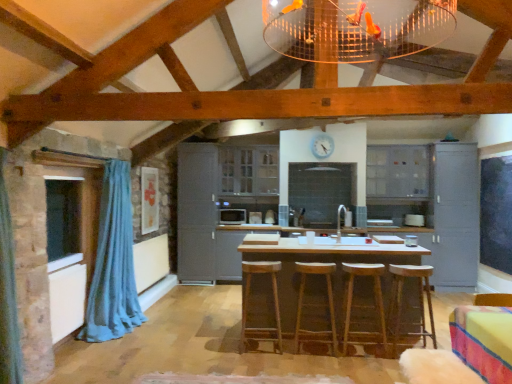
Find the location of a particular element. The width and height of the screenshot is (512, 384). wooden table at center is located at coordinates (323, 290).

In order to face transparent glass window at left, should I rotate leftwards or rightwards?

Rotate left and turn 24.124 degrees.

What do you see at coordinates (63, 222) in the screenshot? I see `transparent glass window at left` at bounding box center [63, 222].

What is the approximate width of wooden bar stool at center, positioned as the second bar stool in left-to-right order?

wooden bar stool at center, positioned as the second bar stool in left-to-right order, is 14.33 inches in width.

You are a GUI agent. You are given a task and a screenshot of the screen. Output one action in this format:
    pyautogui.click(x=<x>, y=<y>)
    Task: Click on the satin black microwave at center
    
    Given the screenshot: What is the action you would take?
    pyautogui.click(x=232, y=216)

Locate an element on the screen. This screenshot has width=512, height=384. wooden table at center is located at coordinates (323, 290).

Considering the positions of objects wooden table at center and wooden bar stool at center, placed as the fourth bar stool when sorted from left to right, in the image provided, who is behind, wooden table at center or wooden bar stool at center, placed as the fourth bar stool when sorted from left to right,?

wooden table at center.

Is point (306, 326) positioned before point (428, 332)?

No, (306, 326) is behind (428, 332).

Consider the image. Between wooden table at center and wooden bar stool at center, placed as the fourth bar stool when sorted from left to right, which one has larger size?

wooden table at center.

From the image's perspective, does matte gray cabinet at center, the 1th cabinetry when ordered from left to right, appear lower than wooden bar stool at center?

Actually, matte gray cabinet at center, the 1th cabinetry when ordered from left to right, appears above wooden bar stool at center in the image.

Which object is more forward, matte gray cabinet at center, the fourth cabinetry when ordered from right to left, or wooden bar stool at center?

wooden bar stool at center is closer to the camera.

Is point (180, 233) positioned behind point (372, 237)?

That is True.

Identify the location of chair below the matte gray cabinet at center, the fourth cabinetry when ordered from right to left (from a real-world perspective). The width and height of the screenshot is (512, 384). point(388,239).

Between point (391, 271) and point (406, 149), which one is positioned behind?

Point (406, 149)

In the scene shown: In the image, is wooden bar stool at center, placed as the fourth bar stool when sorted from left to right, on the left side or the right side of matte gray cabinets at upper right, the 3th cabinetry viewed from the left?

From the image, it's evident that wooden bar stool at center, placed as the fourth bar stool when sorted from left to right, is to the left of matte gray cabinets at upper right, the 3th cabinetry viewed from the left.

Is transparent glass window at left facing away from satin black microwave at center?

No, transparent glass window at left is not facing away from satin black microwave at center.

Find the location of a particular element. This screenshot has width=512, height=384. appliance behind the transparent glass window at left is located at coordinates (232, 216).

Which of these two, transparent glass window at left or satin black microwave at center, stands shorter?

satin black microwave at center.

Is point (111, 296) closer or farther from the camera than point (399, 326)?

Point (111, 296) is positioned farther from the camera compared to point (399, 326).

Is blue fabric curtain at left far away from wooden bar stool at center, placed as the fourth bar stool when sorted from left to right?

Yes, blue fabric curtain at left and wooden bar stool at center, placed as the fourth bar stool when sorted from left to right, are quite far apart.

Who is bigger, blue fabric curtain at left or wooden bar stool at center, marked as the 1th bar stool in a right-to-left arrangement?

Bigger between the two is blue fabric curtain at left.

Which is in front, blue fabric curtain at left or wooden bar stool at center, placed as the fourth bar stool when sorted from left to right?

Positioned in front is wooden bar stool at center, placed as the fourth bar stool when sorted from left to right.

Is brown wooden bar stool at center, placed as the 1th bar stool when sorted from left to right, aimed at wooden bar stool at center, arranged as the 3th bar stool when viewed from the right?

No, brown wooden bar stool at center, placed as the 1th bar stool when sorted from left to right, is not facing towards wooden bar stool at center, arranged as the 3th bar stool when viewed from the right.

From a real-world perspective, who is located higher, brown wooden bar stool at center, arranged as the 4th bar stool when viewed from the right, or wooden bar stool at center, positioned as the second bar stool in left-to-right order?

brown wooden bar stool at center, arranged as the 4th bar stool when viewed from the right, is physically above.

In terms of width, does brown wooden bar stool at center, placed as the 1th bar stool when sorted from left to right, look wider or thinner when compared to wooden bar stool at center, arranged as the 3th bar stool when viewed from the right?

Clearly, brown wooden bar stool at center, placed as the 1th bar stool when sorted from left to right, has less width compared to wooden bar stool at center, arranged as the 3th bar stool when viewed from the right.

From the image's perspective, does brown wooden bar stool at center, placed as the 1th bar stool when sorted from left to right, appear lower than wooden bar stool at center, positioned as the second bar stool in left-to-right order?

No, from the image's perspective, brown wooden bar stool at center, placed as the 1th bar stool when sorted from left to right, is not below wooden bar stool at center, positioned as the second bar stool in left-to-right order.

Is satin black microwave at center touching wooden table at center?

No, satin black microwave at center is not next to wooden table at center.

From a real-world perspective, is satin black microwave at center physically above wooden table at center?

Correct, in the physical world, satin black microwave at center is higher than wooden table at center.

From the image's perspective, is satin black microwave at center above wooden table at center?

Yes, from the image's perspective, satin black microwave at center is on top of wooden table at center.

Is wooden table at center at the back of satin black microwave at center?

No, satin black microwave at center's orientation is not away from wooden table at center.

The image size is (512, 384). In order to click on table located behind the wooden bar stool at center, placed as the fourth bar stool when sorted from left to right in this screenshot , I will do `click(323, 290)`.

From the image's perspective, count 2nd cabinetrys upward from the wooden bar stool at center and point to it. Please provide its 2D coordinates.

[(196, 211)]

Looking at this image, considering their positions, is matte gray cabinet at center, the 1th cabinetry when ordered from left to right, positioned closer to wooden bar stool at center, placed as the fourth bar stool when sorted from left to right, than matte gray cabinets at center, arranged as the 2th cabinetry when viewed from the left?

matte gray cabinets at center, arranged as the 2th cabinetry when viewed from the left.

Which object lies nearer to the anchor point wooden bar stool at center, marked as the 1th bar stool in a right-to-left arrangement, wooden bar stool at center, arranged as the 3th bar stool when viewed from the right, or blue fabric curtain at left?

wooden bar stool at center, arranged as the 3th bar stool when viewed from the right, lies closer to wooden bar stool at center, marked as the 1th bar stool in a right-to-left arrangement, than the other object.

Estimate the real-world distances between objects in this image. Which object is closer to blue fabric curtain at left, wooden bar stool at center, marked as the 1th bar stool in a right-to-left arrangement, or matte gray cabinets at upper right, which is the 2th cabinetry in right-to-left order?

Based on the image, wooden bar stool at center, marked as the 1th bar stool in a right-to-left arrangement, appears to be nearer to blue fabric curtain at left.

Considering their positions, is wooden bar stool at center, placed as the fourth bar stool when sorted from left to right, positioned closer to matte gray cabinets at upper right, the 3th cabinetry viewed from the left, than transparent glass window at left?

The object closer to matte gray cabinets at upper right, the 3th cabinetry viewed from the left, is wooden bar stool at center, placed as the fourth bar stool when sorted from left to right.

Based on the photo, when comparing their distances from wooden table at center, does brown wooden bar stool at center, placed as the 1th bar stool when sorted from left to right, or wooden bar stool at center, which is the 3th bar stool from left to right, seem closer?

wooden bar stool at center, which is the 3th bar stool from left to right.

Which object lies further to the anchor point satin black microwave at center, brown wooden bar stool at center, arranged as the 4th bar stool when viewed from the right, or matte gray cabinet at right, positioned as the 1th cabinetry in right-to-left order?

Among the two, matte gray cabinet at right, positioned as the 1th cabinetry in right-to-left order, is located further to satin black microwave at center.

Which object lies further to the anchor point matte gray cabinets at upper right, which is the 2th cabinetry in right-to-left order, transparent glass window at left or matte gray cabinets at center, arranged as the 3th cabinetry when viewed from the right?

transparent glass window at left.

Considering their positions, is matte gray cabinets at center, arranged as the 3th cabinetry when viewed from the right, positioned closer to wooden bar stool at center, arranged as the 3th bar stool when viewed from the right, than transparent glass window at left?

transparent glass window at left is positioned closer to the anchor wooden bar stool at center, arranged as the 3th bar stool when viewed from the right.

Where is `table between wooden bar stool at center, marked as the 1th bar stool in a right-to-left arrangement, and matte gray cabinet at right, which appears as the fourth cabinetry when viewed from the left, in the front-back direction`? Image resolution: width=512 pixels, height=384 pixels. table between wooden bar stool at center, marked as the 1th bar stool in a right-to-left arrangement, and matte gray cabinet at right, which appears as the fourth cabinetry when viewed from the left, in the front-back direction is located at coordinates (323, 290).

I want to click on bar stool located between wooden table at center and wooden bar stool at center, placed as the fourth bar stool when sorted from left to right, in the left-right direction, so click(352, 297).

What are the coordinates of `table between wooden bar stool at center, marked as the 1th bar stool in a right-to-left arrangement, and matte gray cabinet at center, the 1th cabinetry when ordered from left to right, from front to back` in the screenshot? It's located at (323, 290).

Locate an element on the screen. table between satin black microwave at center and matte gray cabinet at right, positioned as the 1th cabinetry in right-to-left order is located at coordinates (323, 290).